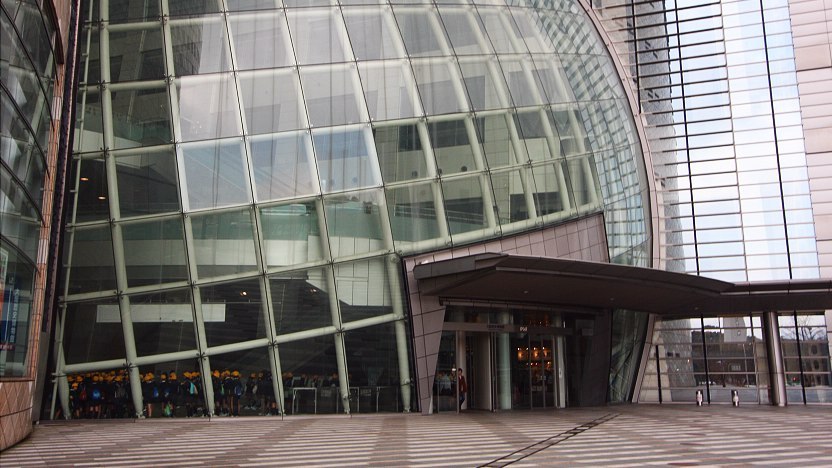
Find the location of a particular element. The height and width of the screenshot is (468, 832). ligting inside building yellow is located at coordinates click(x=543, y=345).